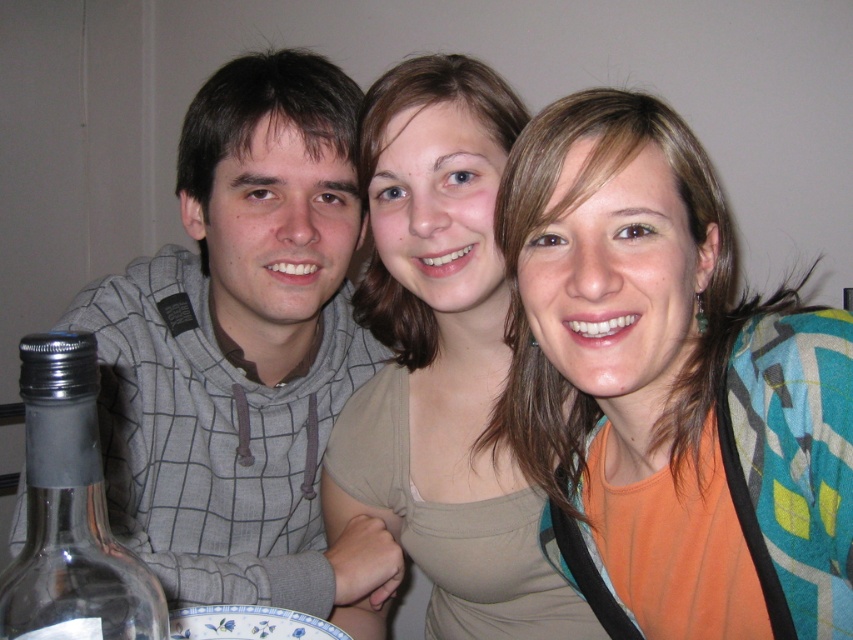
Looking at this image, can you confirm if gray checkered hoodie at left is wider than transparent glass bottle at left?

Yes, gray checkered hoodie at left is wider than transparent glass bottle at left.

Does gray checkered hoodie at left appear under transparent glass bottle at left?

No, gray checkered hoodie at left is not below transparent glass bottle at left.

Which is behind, point (67, 321) or point (51, 506)?

The point (67, 321) is more distant.

Identify the location of gray checkered hoodie at left. (242, 349).

The image size is (853, 640). What do you see at coordinates (669, 388) in the screenshot?
I see `orange fabric at center` at bounding box center [669, 388].

Find the location of a particular element. orange fabric at center is located at coordinates (669, 388).

I want to click on orange fabric at center, so click(669, 388).

At what (x,y) coordinates should I click in order to perform the action: click on orange fabric at center. Please return your answer as a coordinate pair (x, y). This screenshot has width=853, height=640. Looking at the image, I should click on (669, 388).

Which of these two, gray checkered hoodie at left or blue and white ceramic plate at lower center, stands shorter?

With less height is blue and white ceramic plate at lower center.

Does gray checkered hoodie at left have a greater height compared to blue and white ceramic plate at lower center?

Correct, gray checkered hoodie at left is much taller as blue and white ceramic plate at lower center.

Between point (280, 88) and point (274, 609), which one is positioned behind?

Point (280, 88)

You are a GUI agent. You are given a task and a screenshot of the screen. Output one action in this format:
    pyautogui.click(x=<x>, y=<y>)
    Task: Click on the gray checkered hoodie at left
    This screenshot has height=640, width=853.
    Given the screenshot: What is the action you would take?
    pyautogui.click(x=242, y=349)